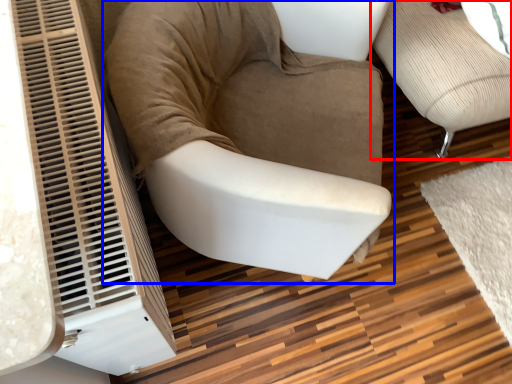
Question: Which point is closer to the camera, furniture (highlighted by a red box) or chair (highlighted by a blue box)?

Choices:
 (A) furniture
 (B) chair

Answer: (B)